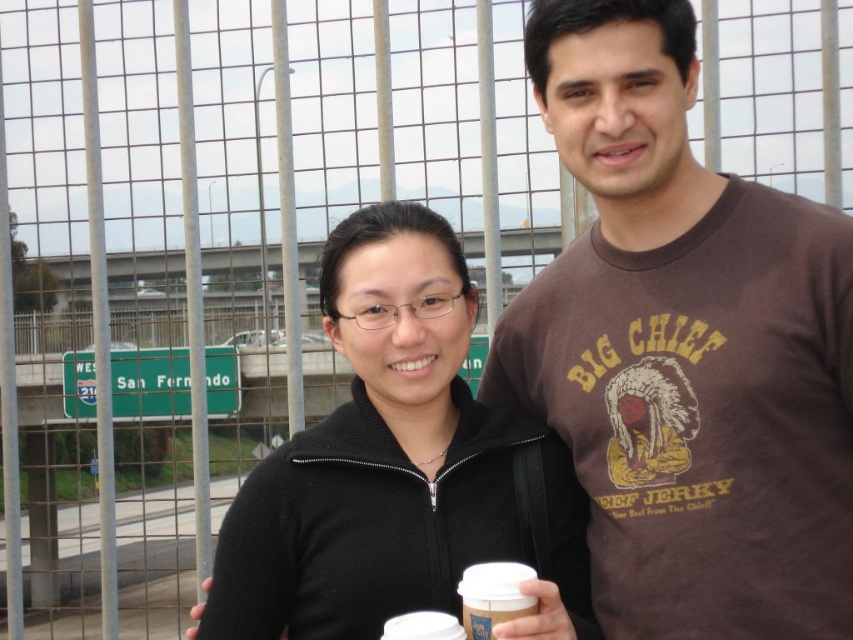
You are a photographer trying to capture both the black matte jacket at center and the white paper cup at center in a single frame. Which object should you focus on first to ensure both are in the frame?

The black matte jacket at center is larger than the white paper cup at center, so you should focus on the black matte jacket at center first to ensure both fit within the frame.